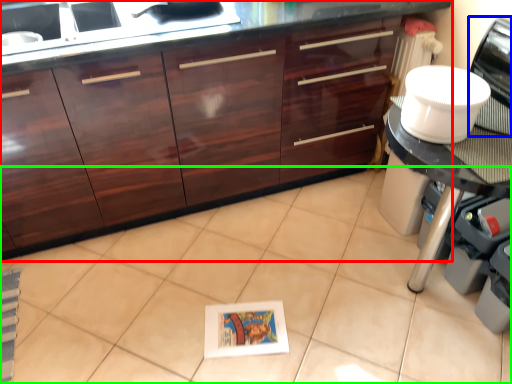
Question: Which object is the closest to the cabinetry (highlighted by a red box)? Choose among these: home appliance (highlighted by a blue box) or ceramic tile (highlighted by a green box).

Choices:
 (A) home appliance
 (B) ceramic tile

Answer: (B)